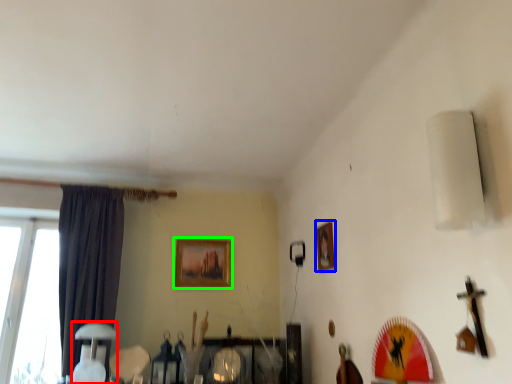
Question: Based on their relative distances, which object is nearer to table lamp (highlighted by a red box)? Choose from picture frame (highlighted by a blue box) and picture frame (highlighted by a green box).

Choices:
 (A) picture frame
 (B) picture frame

Answer: (B)